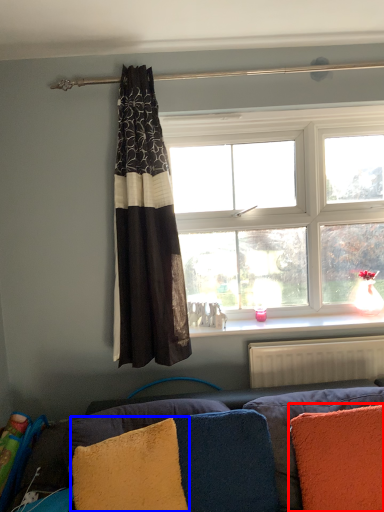
Question: Which of the following is the farthest to the observer, pillow (highlighted by a red box) or pillow (highlighted by a blue box)?

Choices:
 (A) pillow
 (B) pillow

Answer: (A)